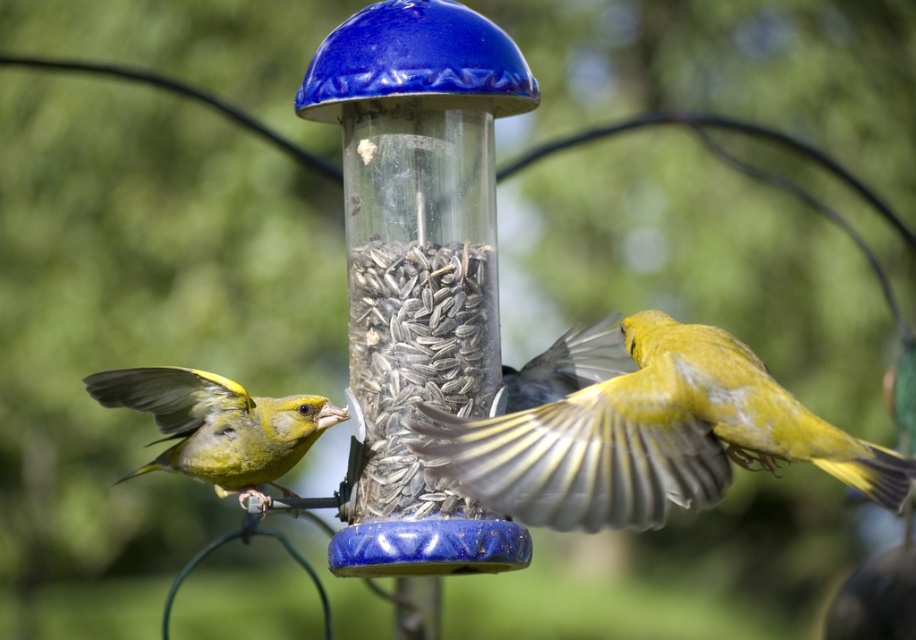
You are a birdwatcher trying to locate the yellow feathered bird at center. According to the coordinates provided, where would you focus your binoculars to find it?

The yellow feathered bird at center is located at coordinates point [650,436], so you should focus your binoculars there to spot it.

You are a birdwatcher observing the scene. Which bird is positioned higher in the image, the yellow feathered bird at center or the green matte bird at left?

The yellow feathered bird at center is positioned higher than the green matte bird at left in the image.

You are a bird with a wingspan of 14 inches. You want to land on the feeder to eat the gray textured seeds at center. Can you reach the seeds from your current position on the yellow feathered bird at center without spreading your wings wider than your wingspan?

The distance between the yellow feathered bird at center and the gray textured seeds at center is 16.33 inches, which is greater than your wingspan of 14 inches. Therefore, you cannot reach the seeds without spreading your wings beyond your wingspan.